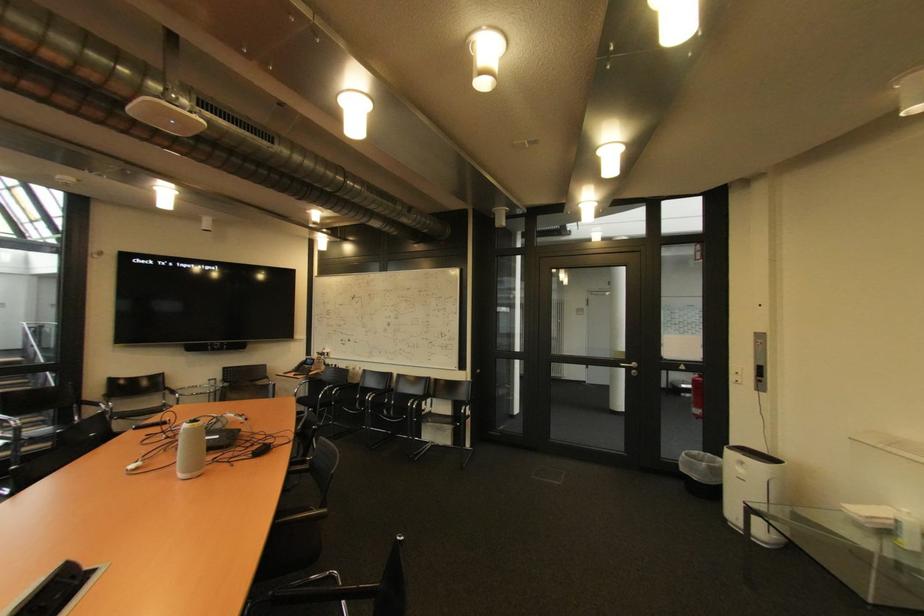
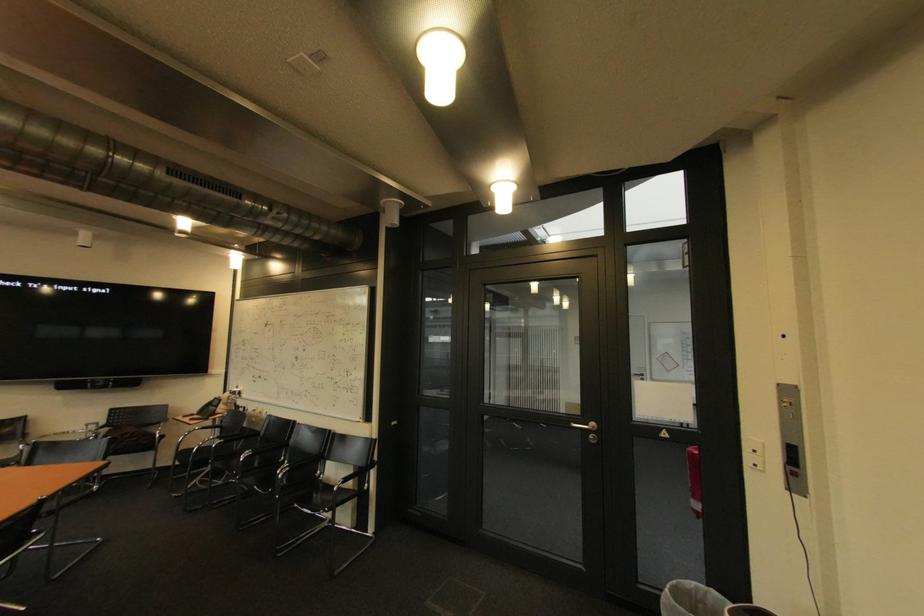
Locate, in the second image, the point that corresponds to [699,411] in the first image.

(698, 501)